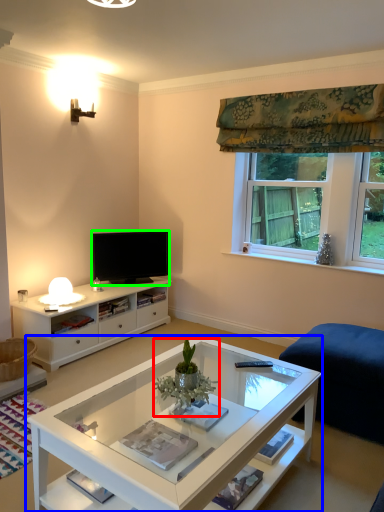
Question: Considering the real-world distances, which object is closest to houseplant (highlighted by a red box)? coffee table (highlighted by a blue box) or television (highlighted by a green box).

Choices:
 (A) coffee table
 (B) television

Answer: (A)